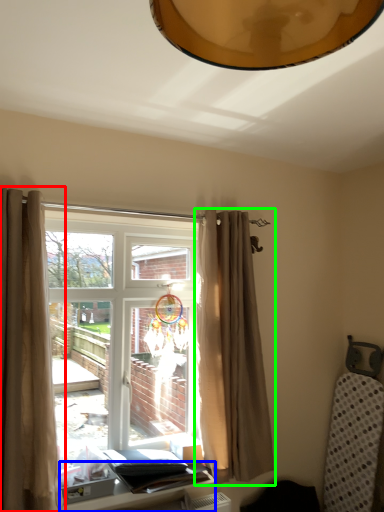
Question: Which object is the closest to the curtain (highlighted by a red box)? Choose among these: table (highlighted by a blue box) or curtain (highlighted by a green box).

Choices:
 (A) table
 (B) curtain

Answer: (A)